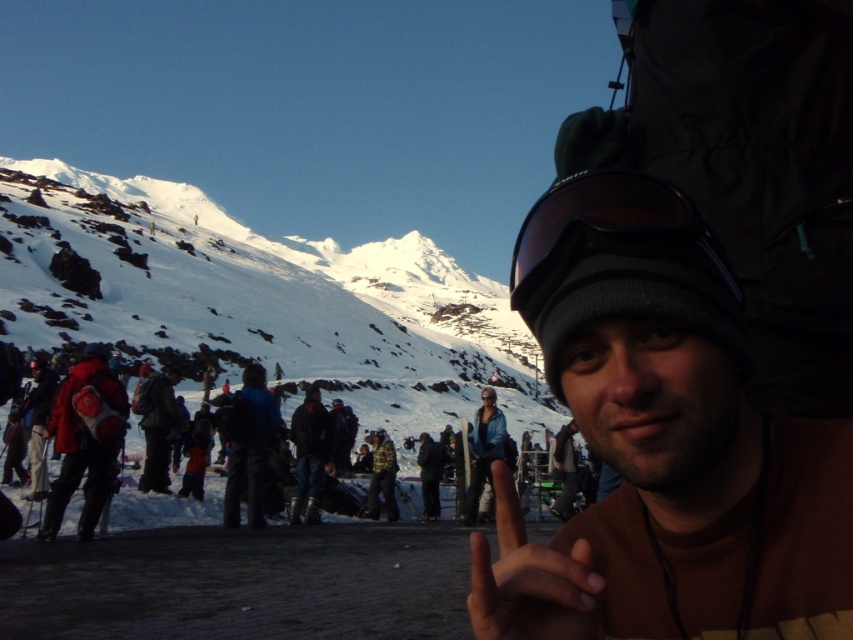
Question: Does dark matte hand at center have a larger size compared to red matte backpack at left?

Choices:
 (A) yes
 (B) no

Answer: (B)

Question: Considering the real-world distances, which object is farthest from the dark matte hand at center?

Choices:
 (A) brown woolen hat at center
 (B) blue fabric jacket at center

Answer: (B)

Question: Which point appears farthest from the camera in this image?

Choices:
 (A) (476, 534)
 (B) (250, 420)
 (C) (54, 488)

Answer: (B)

Question: Does dark matte hand at center have a lesser width compared to red matte backpack at left?

Choices:
 (A) yes
 (B) no

Answer: (A)

Question: Which is nearer to the dark matte hand at center?

Choices:
 (A) brown woolen hat at center
 (B) black matte goggles at center

Answer: (A)

Question: Where is brown woolen hat at center located in relation to blue fabric jacket at center in the image?

Choices:
 (A) left
 (B) right

Answer: (B)